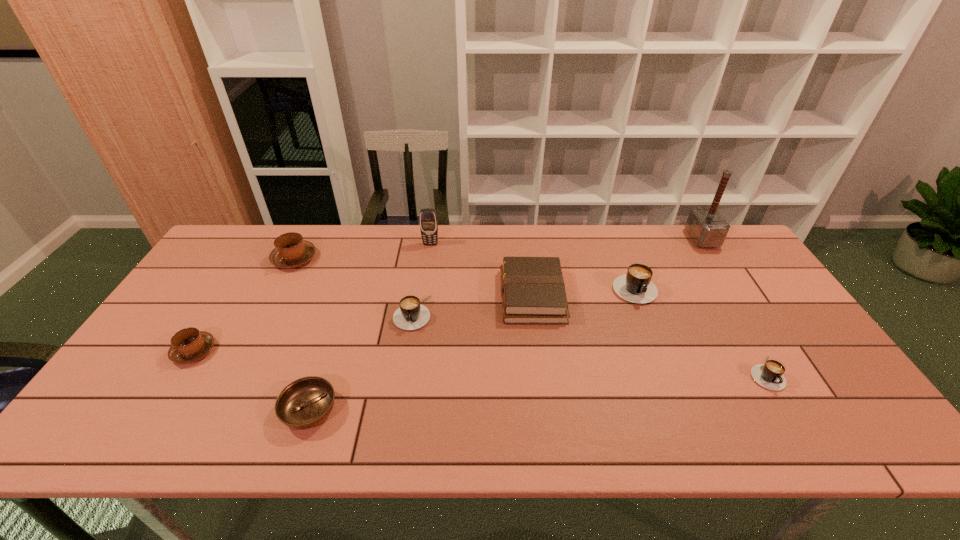
Where is `free space located 0.310m on the spine side of the Bible`? The height and width of the screenshot is (540, 960). free space located 0.310m on the spine side of the Bible is located at coordinates coord(396,296).

Find the location of a particular element. The image size is (960, 540). vacant region located 0.140m on the spine side of the Bible is located at coordinates (454, 296).

The width and height of the screenshot is (960, 540). Identify the location of free space located 0.260m with the handle on the side of the leftmost black cappuccino. (396, 417).

You are a GUI agent. You are given a task and a screenshot of the screen. Output one action in this format:
    pyautogui.click(x=<x>, y=<y>)
    Task: Click on the free spot located 0.190m on the side of the leftmost object with the handle
    
    Given the screenshot: What is the action you would take?
    pyautogui.click(x=140, y=438)

Identify the location of free space located with the handle on the side of the rightmost black cappuccino. (791, 418).

Find the location of a particular element. The height and width of the screenshot is (540, 960). vacant region located 0.130m on the back of the soup bowl is located at coordinates (331, 346).

Identify the location of hammer situated at the far edge. (705, 224).

Locate an element on the screen. The width and height of the screenshot is (960, 540). cellular telephone that is at the far edge is located at coordinates (428, 219).

Image resolution: width=960 pixels, height=540 pixels. Identify the location of object that is at the near edge. (306, 402).

The height and width of the screenshot is (540, 960). I want to click on object located at the left edge, so click(x=188, y=345).